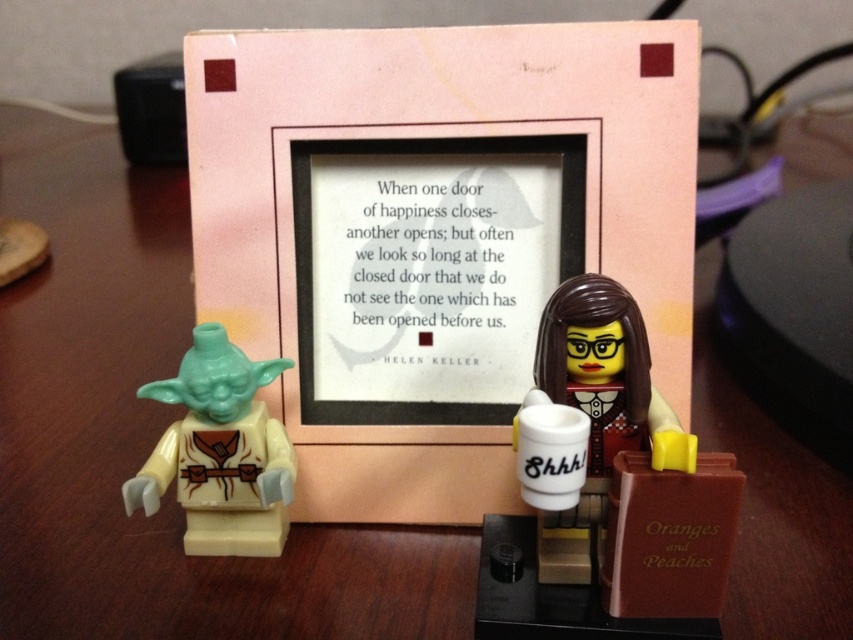
Question: Which of the following is the closest to the observer?

Choices:
 (A) (183, 356)
 (B) (583, 372)

Answer: (B)

Question: Does light green plastic yoda at left have a lesser width compared to white glossy mug at center?

Choices:
 (A) yes
 (B) no

Answer: (B)

Question: From the image, what is the correct spatial relationship of light green plastic yoda at left in relation to white glossy mug at center?

Choices:
 (A) left
 (B) right

Answer: (A)

Question: Can you confirm if light green plastic yoda at left is positioned above white glossy mug at center?

Choices:
 (A) no
 (B) yes

Answer: (A)